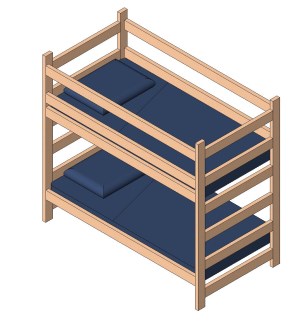
At what (x,y) coordinates should I click in order to perform the action: click on sheets. Please return your answer as a coordinate pair (x, y). This screenshot has height=330, width=289. Looking at the image, I should click on (163, 207).